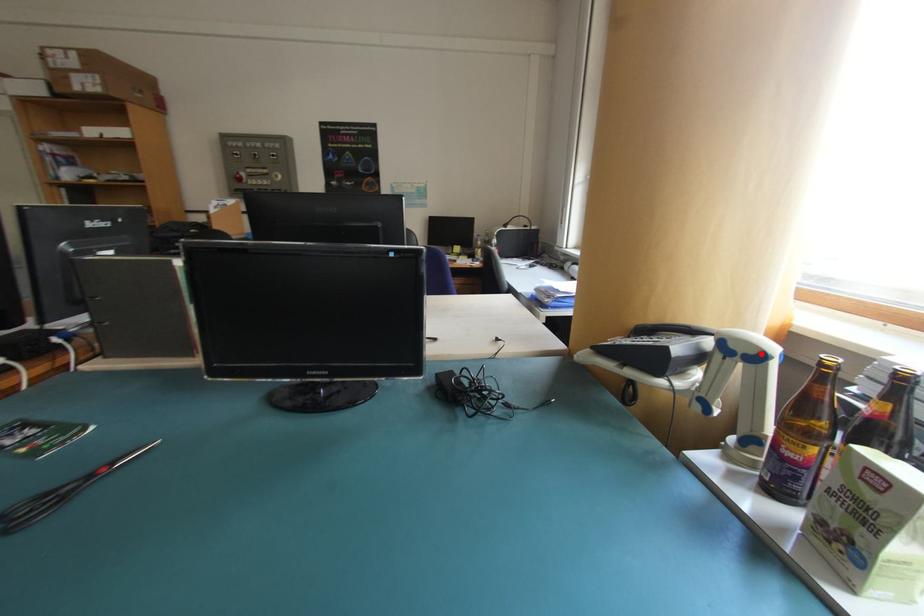
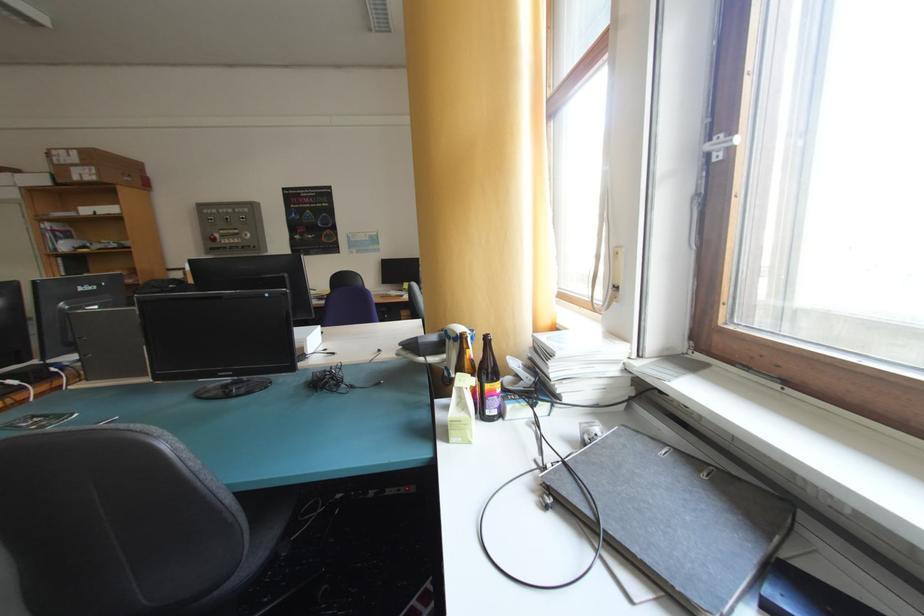
Question: I am providing you with two images of the same scene from different viewpoints. A red point is marked on the first image. Is the red point's position out of view in image 2?

Choices:
 (A) Yes
 (B) No

Answer: (B)